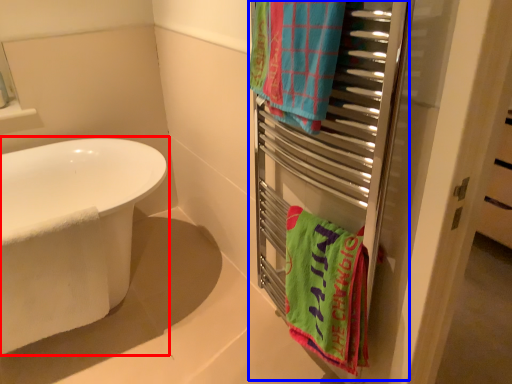
Question: Which object is closer to the camera taking this photo, bathtub (highlighted by a red box) or closet (highlighted by a blue box)?

Choices:
 (A) bathtub
 (B) closet

Answer: (B)